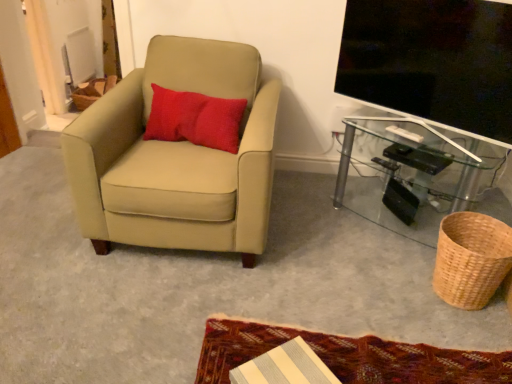
Locate an element on the screen. This screenshot has height=384, width=512. free point behind textured woolen mat at lower center is located at coordinates (340, 266).